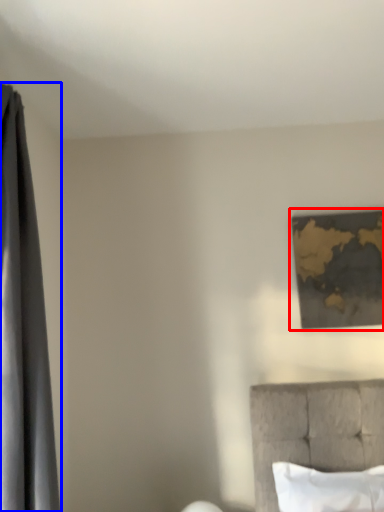
Question: Which object is closer to the camera taking this photo, picture frame (highlighted by a red box) or curtain (highlighted by a blue box)?

Choices:
 (A) picture frame
 (B) curtain

Answer: (B)